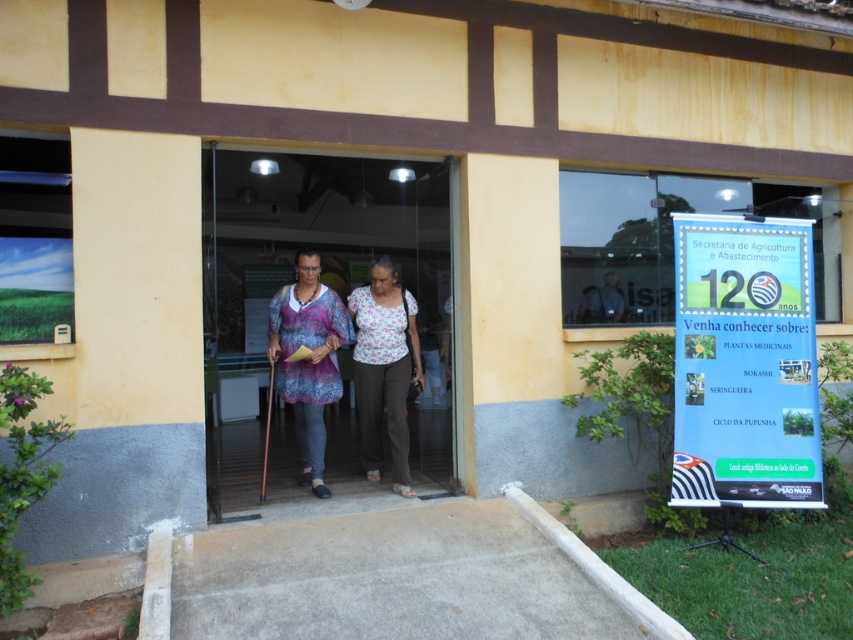
Both individuals are wearing shirts. The person in the floral fabric blouse at center and the person in the dark blue shirt at center. Which one has a larger shirt?

The floral fabric blouse at center is larger in size than the dark blue shirt at center.